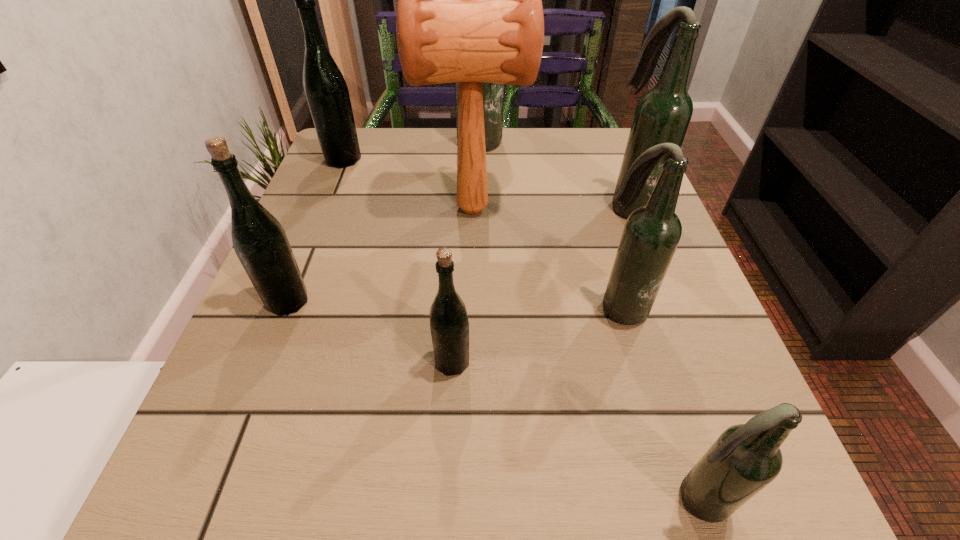
Identify the location of blank area in the image that satisfies the following two spatial constraints: 1. on the front side of the second nearest dark beer bottle; 2. on the left side of the nearest dark beer bottle. This screenshot has height=540, width=960. (676, 498).